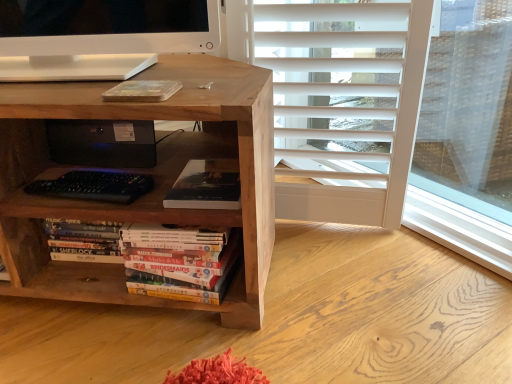
In order to face natural wood desk at center, should I rotate leftwards or rightwards?

Turn left approximately 22.977 degrees to face it.

The height and width of the screenshot is (384, 512). In order to click on hardcover books at center, which is the 2th book from top to bottom in this screenshot , I will do `click(155, 255)`.

Is point (12, 145) behind point (162, 281)?

No, (12, 145) is in front of (162, 281).

Can you confirm if natural wood desk at center is shorter than hardcover books at center, the first book when ordered from bottom to top?

Incorrect, the height of natural wood desk at center does not fall short of that of hardcover books at center, the first book when ordered from bottom to top.

From a real-world perspective, is natural wood desk at center physically above hardcover books at center, the first book when ordered from bottom to top?

Yes, from a real-world perspective, natural wood desk at center is on top of hardcover books at center, the first book when ordered from bottom to top.

Can you confirm if natural wood desk at center is positioned to the left of hardcover books at center, which is the 2th book from top to bottom?

Indeed, natural wood desk at center is positioned on the left side of hardcover books at center, which is the 2th book from top to bottom.

Between black plastic speaker at center and natural wood desk at center, which one appears on the right side from the viewer's perspective?

Positioned to the right is black plastic speaker at center.

Is there a large distance between black plastic speaker at center and natural wood desk at center?

No, there isn't a large distance between black plastic speaker at center and natural wood desk at center.

From the image's perspective, is black plastic speaker at center on natural wood desk at center?

Correct, black plastic speaker at center appears higher than natural wood desk at center in the image.

Choose the correct answer: Is black plastic speaker at center inside natural wood desk at center or outside it?

The correct answer is: inside.

Is natural wood desk at center taller than matte black book at center, positioned as the second book in bottom-to-top order?

Indeed, natural wood desk at center has a greater height compared to matte black book at center, positioned as the second book in bottom-to-top order.

Can you confirm if natural wood desk at center is thinner than matte black book at center, positioned as the first book in top-to-bottom order?

In fact, natural wood desk at center might be wider than matte black book at center, positioned as the first book in top-to-bottom order.

Considering the positions of objects natural wood desk at center and matte black book at center, positioned as the first book in top-to-bottom order, in the image provided, who is more to the right, natural wood desk at center or matte black book at center, positioned as the first book in top-to-bottom order,?

matte black book at center, positioned as the first book in top-to-bottom order.

Can you tell me how much natural wood desk at center and matte black book at center, positioned as the first book in top-to-bottom order, differ in facing direction?

The angle between the facing direction of natural wood desk at center and the facing direction of matte black book at center, positioned as the first book in top-to-bottom order, is 2.69 degrees.

Considering the sizes of objects black plastic speaker at center and matte black book at center, positioned as the second book in bottom-to-top order, in the image provided, who is thinner, black plastic speaker at center or matte black book at center, positioned as the second book in bottom-to-top order,?

With smaller width is matte black book at center, positioned as the second book in bottom-to-top order.

Considering the positions of point (53, 144) and point (230, 201), is point (53, 144) closer or farther from the camera than point (230, 201)?

Point (53, 144) appears to be farther away from the viewer than point (230, 201).

Which is correct: black plastic speaker at center is inside matte black book at center, positioned as the first book in top-to-bottom order, or outside of it?

black plastic speaker at center is not inside matte black book at center, positioned as the first book in top-to-bottom order, it's outside.

Does black plastic speaker at center have a larger size compared to matte black book at center, positioned as the second book in bottom-to-top order?

Yes.

At what (x,y) coordinates should I click in order to perform the action: click on book above the hardcover books at center, which is the 2th book from top to bottom (from a real-world perspective). Please return your answer as a coordinate pair (x, y). Image resolution: width=512 pixels, height=384 pixels. Looking at the image, I should click on tap(206, 185).

From their relative heights in the image, would you say matte black book at center, positioned as the second book in bottom-to-top order, is taller or shorter than hardcover books at center, the first book when ordered from bottom to top?

matte black book at center, positioned as the second book in bottom-to-top order, is shorter than hardcover books at center, the first book when ordered from bottom to top.

Consider the image. From a real-world perspective, who is located lower, matte black book at center, positioned as the first book in top-to-bottom order, or hardcover books at center, which is the 2th book from top to bottom?

From a 3D spatial view, hardcover books at center, which is the 2th book from top to bottom, is below.

Considering the positions of objects matte black book at center, positioned as the first book in top-to-bottom order, and hardcover books at center, the first book when ordered from bottom to top, in the image provided, who is behind, matte black book at center, positioned as the first book in top-to-bottom order, or hardcover books at center, the first book when ordered from bottom to top,?

matte black book at center, positioned as the first book in top-to-bottom order, is more distant.

From the image's perspective, is black plastic speaker at center above or below hardcover books at center, the first book when ordered from bottom to top?

black plastic speaker at center is above hardcover books at center, the first book when ordered from bottom to top.

Is point (57, 142) closer to camera compared to point (186, 279)?

No, (57, 142) is behind (186, 279).

Does black plastic speaker at center appear on the left side of hardcover books at center, which is the 2th book from top to bottom?

Correct, you'll find black plastic speaker at center to the left of hardcover books at center, which is the 2th book from top to bottom.

Choose the correct answer: Is black plastic speaker at center inside hardcover books at center, which is the 2th book from top to bottom, or outside it?

black plastic speaker at center exists outside the volume of hardcover books at center, which is the 2th book from top to bottom.

Find the location of a particular element. The image size is (512, 384). computer located on the left of hardcover books at center, the first book when ordered from bottom to top is located at coordinates (102, 143).

Is hardcover books at center, the first book when ordered from bottom to top, facing towards black plastic speaker at center?

No, hardcover books at center, the first book when ordered from bottom to top, is not turned towards black plastic speaker at center.

Considering the sizes of hardcover books at center, the first book when ordered from bottom to top, and black plastic speaker at center in the image, is hardcover books at center, the first book when ordered from bottom to top, bigger or smaller than black plastic speaker at center?

Considering their sizes, hardcover books at center, the first book when ordered from bottom to top, takes up more space than black plastic speaker at center.

Is hardcover books at center, which is the 2th book from top to bottom, inside or outside of black plastic speaker at center?

hardcover books at center, which is the 2th book from top to bottom, lies outside black plastic speaker at center.

Locate an element on the screen. Image resolution: width=512 pixels, height=384 pixels. desk above the hardcover books at center, which is the 2th book from top to bottom (from the image's perspective) is located at coordinates (142, 173).

Where is `desk below the black plastic speaker at center (from a real-world perspective)`? This screenshot has height=384, width=512. desk below the black plastic speaker at center (from a real-world perspective) is located at coordinates (142, 173).

Based on their spatial positions, is natural wood desk at center or black plastic speaker at center closer to matte black book at center, positioned as the first book in top-to-bottom order?

natural wood desk at center.

Estimate the real-world distances between objects in this image. Which object is further from black plastic speaker at center, hardcover books at center, which is the 2th book from top to bottom, or matte black book at center, positioned as the first book in top-to-bottom order?

hardcover books at center, which is the 2th book from top to bottom, lies further to black plastic speaker at center than the other object.

When comparing their distances from hardcover books at center, the first book when ordered from bottom to top, does black plastic speaker at center or matte black book at center, positioned as the second book in bottom-to-top order, seem closer?

Based on the image, matte black book at center, positioned as the second book in bottom-to-top order, appears to be nearer to hardcover books at center, the first book when ordered from bottom to top.

Based on their spatial positions, is natural wood desk at center or matte black book at center, positioned as the first book in top-to-bottom order, closer to hardcover books at center, the first book when ordered from bottom to top?

The object closer to hardcover books at center, the first book when ordered from bottom to top, is natural wood desk at center.

Considering their positions, is matte black book at center, positioned as the first book in top-to-bottom order, positioned closer to black plastic speaker at center than hardcover books at center, which is the 2th book from top to bottom?

The object closer to black plastic speaker at center is matte black book at center, positioned as the first book in top-to-bottom order.

Which object lies further to the anchor point black plastic speaker at center, natural wood desk at center or hardcover books at center, the first book when ordered from bottom to top?

hardcover books at center, the first book when ordered from bottom to top, is further to black plastic speaker at center.

Estimate the real-world distances between objects in this image. Which object is further from matte black book at center, positioned as the second book in bottom-to-top order, hardcover books at center, which is the 2th book from top to bottom, or black plastic speaker at center?

black plastic speaker at center is further to matte black book at center, positioned as the second book in bottom-to-top order.

Considering their positions, is hardcover books at center, which is the 2th book from top to bottom, positioned closer to matte black book at center, positioned as the second book in bottom-to-top order, than natural wood desk at center?

hardcover books at center, which is the 2th book from top to bottom, is positioned closer to the anchor matte black book at center, positioned as the second book in bottom-to-top order.

Identify the location of computer between natural wood desk at center and hardcover books at center, which is the 2th book from top to bottom, from left to right. The image size is (512, 384). (102, 143).

Identify the location of book situated between natural wood desk at center and matte black book at center, positioned as the second book in bottom-to-top order, from left to right. The width and height of the screenshot is (512, 384). (155, 255).

You are a GUI agent. You are given a task and a screenshot of the screen. Output one action in this format:
    pyautogui.click(x=<x>, y=<y>)
    Task: Click on the book between black plastic speaker at center and hardcover books at center, the first book when ordered from bottom to top, vertically
    The width and height of the screenshot is (512, 384).
    Given the screenshot: What is the action you would take?
    tap(206, 185)

Where is `computer between natural wood desk at center and matte black book at center, positioned as the second book in bottom-to-top order, in the horizontal direction`? The image size is (512, 384). computer between natural wood desk at center and matte black book at center, positioned as the second book in bottom-to-top order, in the horizontal direction is located at coordinates (102, 143).